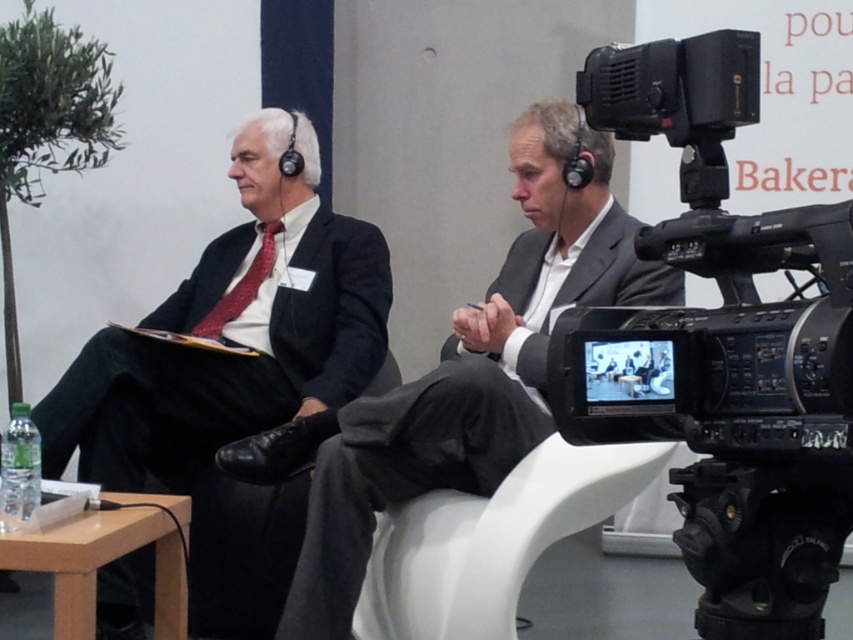
You are a photographer who needs to position a tripod between the black plastic video camera at right and the dark gray suit at center. Which object should you place the tripod closer to for stability?

The black plastic video camera at right has a lesser height compared to the dark gray suit at center, so placing the tripod closer to the taller dark gray suit at center would provide better stability due to its height.

You are a photographer adjusting your equipment in the scene. You notice the black plastic video camera at right and the dark gray suit at center. Which object is placed higher in the frame?

The black plastic video camera at right is positioned over the dark gray suit at center, so it is placed higher in the frame.

You are an event organizer and need to place a name tag on the table between the two men. The name tag should be placed exactly at point (294,301). What object will the name tag be placed on?

The name tag will be placed on the matte black suit at left located at point (294,301).